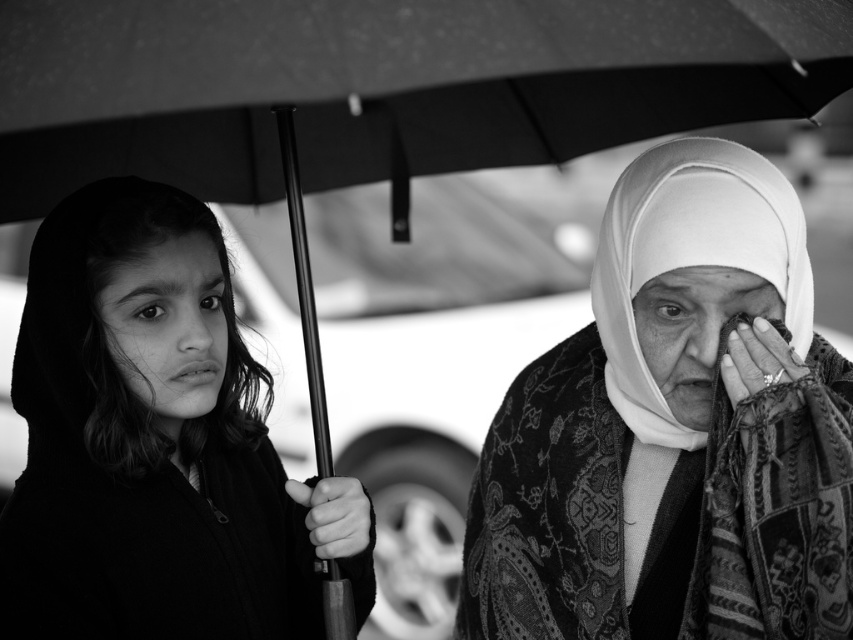
Question: Which object is the farthest from the smooth skin face at center?

Choices:
 (A) white textured veil at right
 (B) matte fabric face at center
 (C) patterned fabric headscarf at center

Answer: (B)

Question: Is patterned fabric headscarf at center positioned behind smooth skin face at center?

Choices:
 (A) no
 (B) yes

Answer: (A)

Question: Which object is the closest to the patterned fabric headscarf at center?

Choices:
 (A) matte fabric face at center
 (B) white textured veil at right
 (C) matte black hijab at upper right
 (D) smooth skin face at center

Answer: (B)

Question: Which object appears closest to the camera in this image?

Choices:
 (A) matte black hijab at upper right
 (B) patterned fabric headscarf at center

Answer: (B)

Question: Does patterned fabric headscarf at center lie behind white textured veil at right?

Choices:
 (A) yes
 (B) no

Answer: (B)

Question: Does patterned fabric headscarf at center have a larger size compared to matte black hijab at upper right?

Choices:
 (A) no
 (B) yes

Answer: (B)